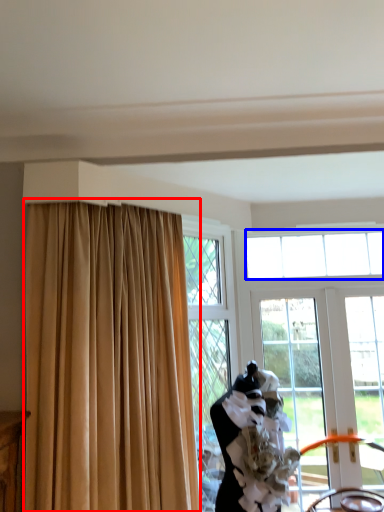
Question: Which of the following is the closest to the observer, curtain (highlighted by a red box) or window (highlighted by a blue box)?

Choices:
 (A) curtain
 (B) window

Answer: (A)